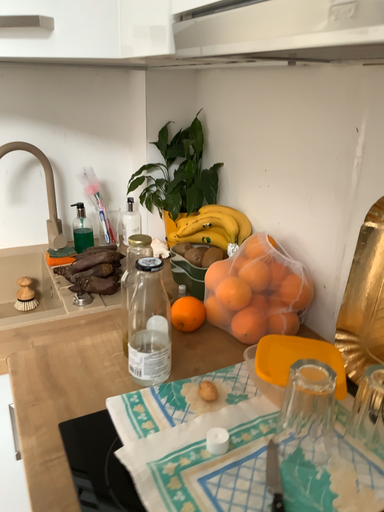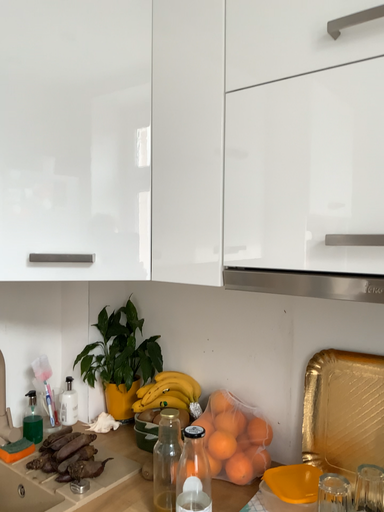
Question: How did the camera likely rotate when shooting the video?

Choices:
 (A) rotated downward
 (B) rotated upward

Answer: (B)